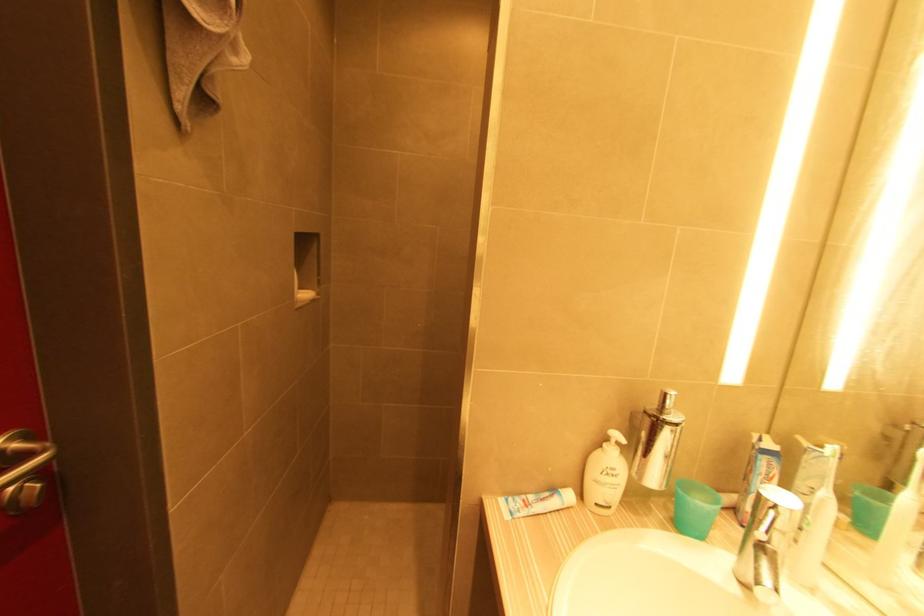
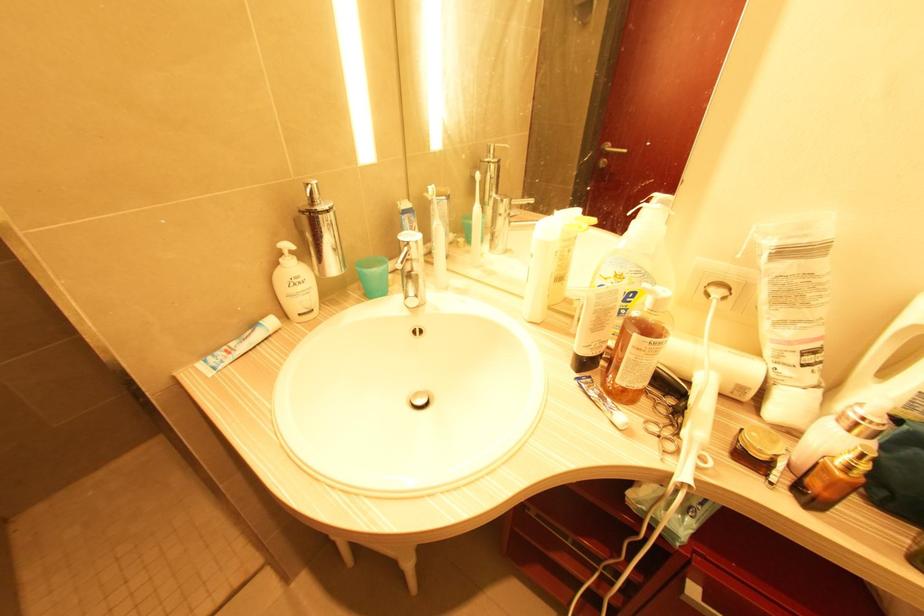
In the second image, find the point that corresponds to the point at 602,448 in the first image.

(280, 265)